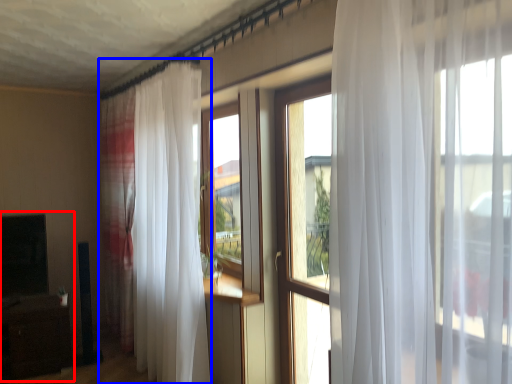
Question: Among these objects, which one is nearest to the camera, entertainment center (highlighted by a red box) or curtain (highlighted by a blue box)?

Choices:
 (A) entertainment center
 (B) curtain

Answer: (B)